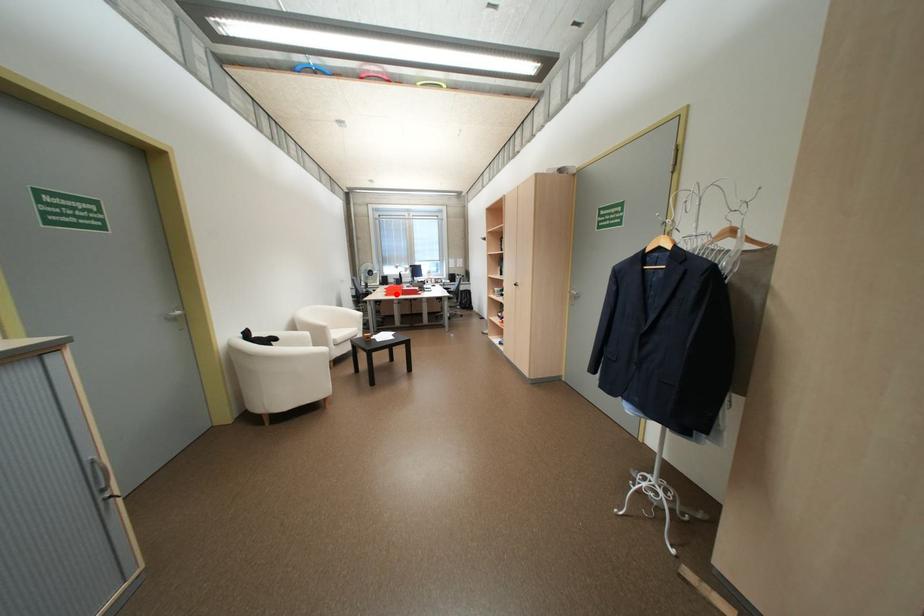
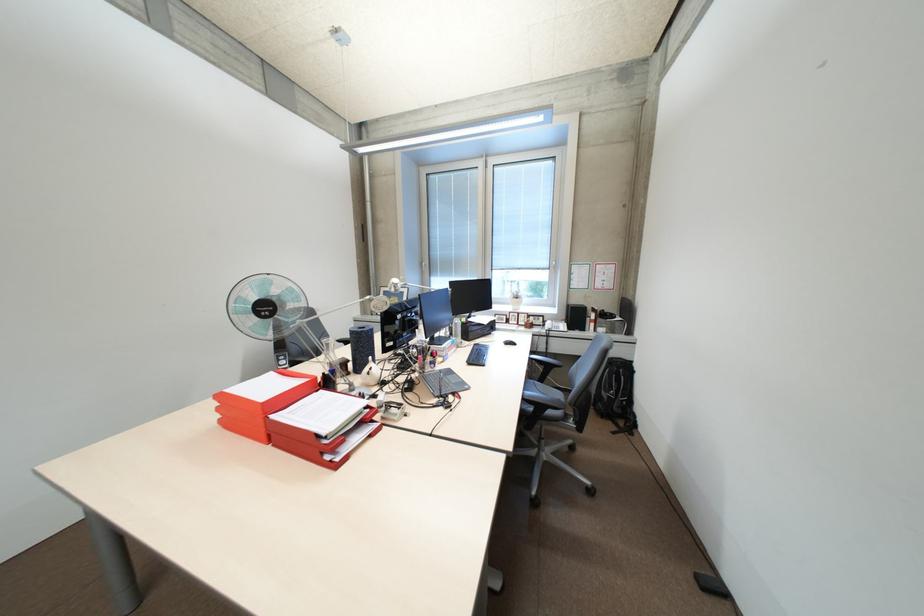
Question: A red point is marked in image1. In image2, is the corresponding 3D point closer to the camera or farther? Reply with the corresponding letter.

Choices:
 (A) The corresponding 3D point is closer.
 (B) The corresponding 3D point is farther.

Answer: (B)